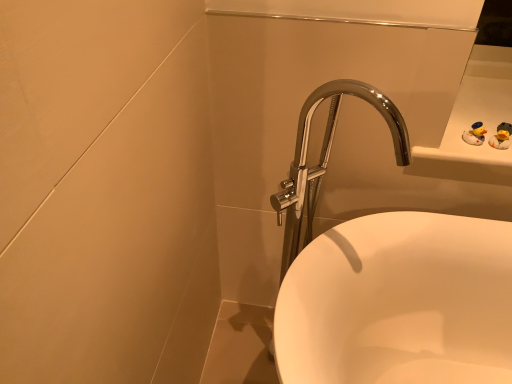
This screenshot has width=512, height=384. I want to click on polished chrome faucet at upper right, so click(388, 280).

What is the approximate height of polished chrome faucet at upper right?

→ It is 1.08 meters.

The image size is (512, 384). What do you see at coordinates (388, 280) in the screenshot?
I see `polished chrome faucet at upper right` at bounding box center [388, 280].

The height and width of the screenshot is (384, 512). I want to click on polished chrome faucet at upper right, so click(x=388, y=280).